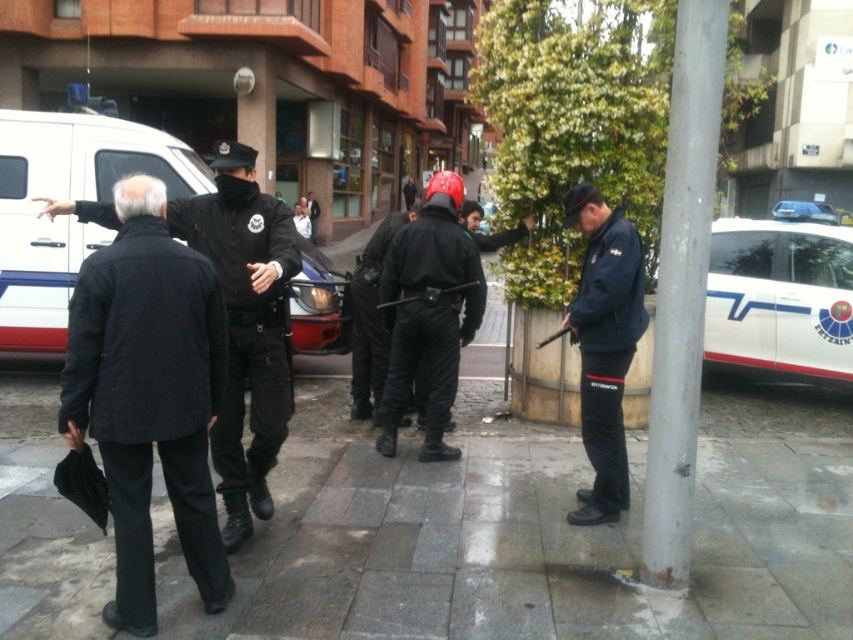
The height and width of the screenshot is (640, 853). What do you see at coordinates (67, 218) in the screenshot?
I see `white matte van at left` at bounding box center [67, 218].

Is white matte van at left bigger than navy blue uniform at center?

Yes, white matte van at left is bigger than navy blue uniform at center.

Identify the location of white matte van at left. This screenshot has height=640, width=853. (67, 218).

The image size is (853, 640). What are the coordinates of `white matte van at left` in the screenshot? It's located at (67, 218).

Can you confirm if matte black helmet at center is positioned to the left of navy blue uniform at center?

Indeed, matte black helmet at center is positioned on the left side of navy blue uniform at center.

In order to click on matte black helmet at center in this screenshot , I will do `click(428, 312)`.

Does point (416, 250) come behind point (612, 339)?

Yes, point (416, 250) is farther from viewer.

At what (x,y) coordinates should I click in order to perform the action: click on matte black helmet at center. Please return your answer as a coordinate pair (x, y). The width and height of the screenshot is (853, 640). Looking at the image, I should click on (428, 312).

Is white glossy police car at right positioned at the back of navy blue uniform at center?

Yes, it is behind navy blue uniform at center.

Is white glossy police car at right shorter than navy blue uniform at center?

Indeed, white glossy police car at right has a lesser height compared to navy blue uniform at center.

Who is more distant from viewer, (711, 330) or (619, 483)?

Point (711, 330)

Where is `white glossy police car at right`? This screenshot has height=640, width=853. white glossy police car at right is located at coordinates (780, 300).